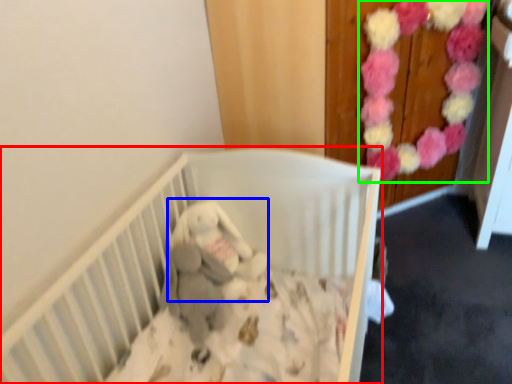
Question: Which object is positioned closest to infant bed (highlighted by a red box)? Select from baby elephant (highlighted by a blue box) and flower (highlighted by a green box).

Choices:
 (A) baby elephant
 (B) flower

Answer: (A)